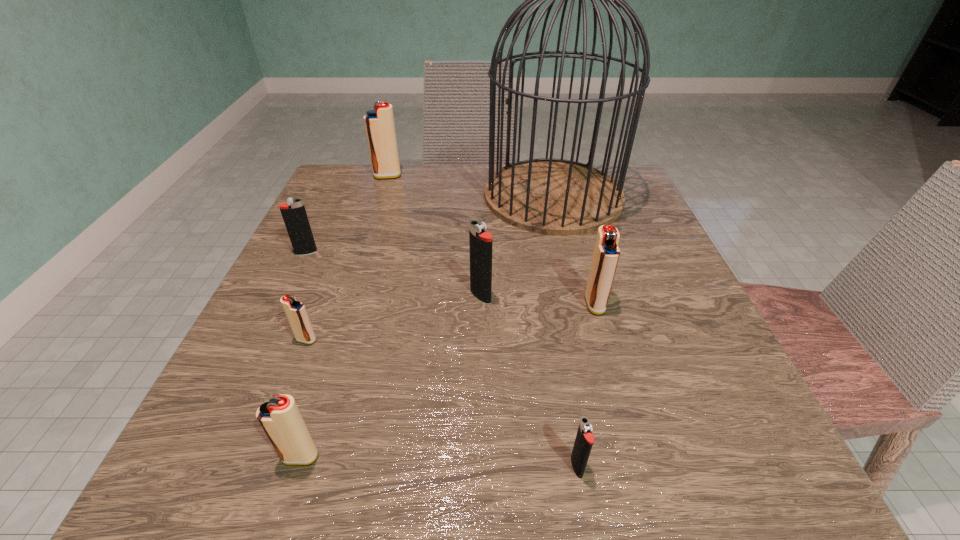
The width and height of the screenshot is (960, 540). What are the coordinates of `object that is at the near left corner` in the screenshot? It's located at (280, 418).

Locate an element on the screen. This screenshot has height=540, width=960. object that is positioned at the far right corner is located at coordinates point(547,196).

In order to click on vacant space at the far edge in this screenshot , I will do `click(503, 166)`.

This screenshot has height=540, width=960. In the image, there is a desktop. In order to click on free space at the left edge in this screenshot , I will do `click(269, 308)`.

In the image, there is a desktop. Identify the location of free space at the right edge. (645, 217).

Locate an element on the screen. The height and width of the screenshot is (540, 960). free space at the far left corner is located at coordinates (345, 180).

The height and width of the screenshot is (540, 960). Find the location of `empty space between the rightmost black igniter and the nearest red igniter`. empty space between the rightmost black igniter and the nearest red igniter is located at coordinates (439, 462).

The image size is (960, 540). In order to click on empty location between the third nearest red igniter and the fifth igniter from left to right in this screenshot , I will do `click(538, 300)`.

This screenshot has width=960, height=540. I want to click on free area in between the tallest igniter and the sixth nearest object, so click(347, 214).

Where is `vacant area that lies between the nearest red igniter and the tallest object`? vacant area that lies between the nearest red igniter and the tallest object is located at coordinates (426, 326).